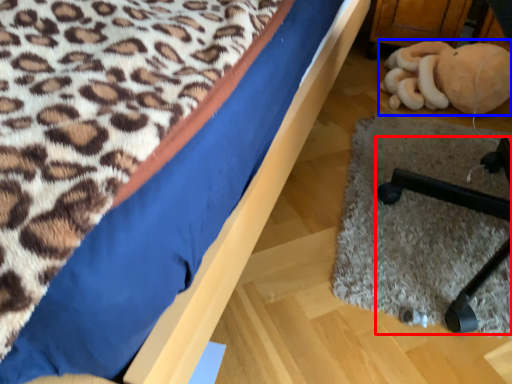
Question: Which object appears farthest to the camera in this image, furniture (highlighted by a red box) or toy (highlighted by a blue box)?

Choices:
 (A) furniture
 (B) toy

Answer: (B)